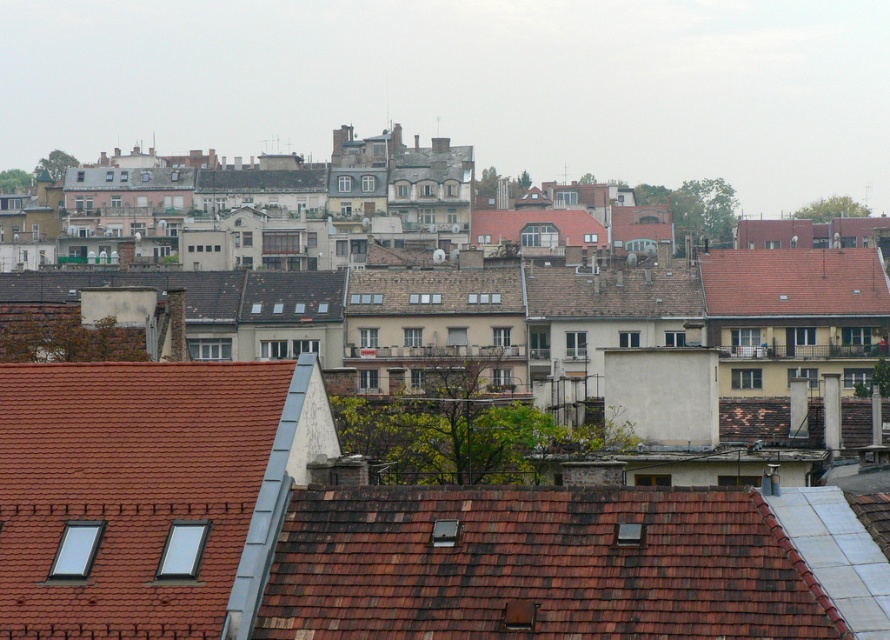
Question: Which object appears closest to the camera in this image?

Choices:
 (A) red tile roof at upper right
 (B) brown shingles at center

Answer: (B)

Question: Can you confirm if brown shingles at center is wider than red tile roof at upper right?

Choices:
 (A) yes
 (B) no

Answer: (B)

Question: Which point is closer to the camera?

Choices:
 (A) brown shingles at center
 (B) red tile roof at upper right

Answer: (A)

Question: Is brown shingles at center above red tile roof at upper right?

Choices:
 (A) no
 (B) yes

Answer: (A)

Question: Is brown shingles at center closer to camera compared to red tile roof at upper right?

Choices:
 (A) yes
 (B) no

Answer: (A)

Question: Which of the following is the farthest from the observer?

Choices:
 (A) (483, 593)
 (B) (783, 285)

Answer: (B)